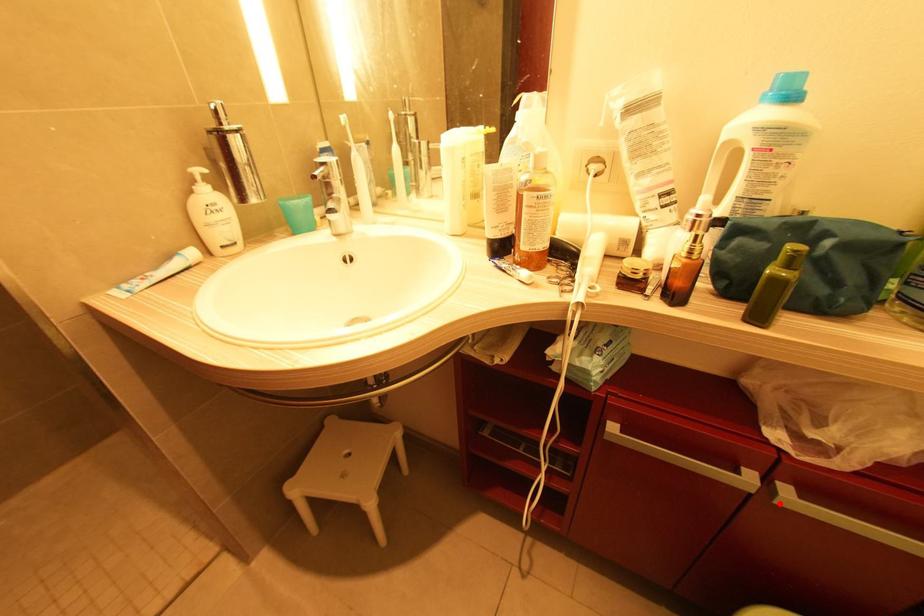
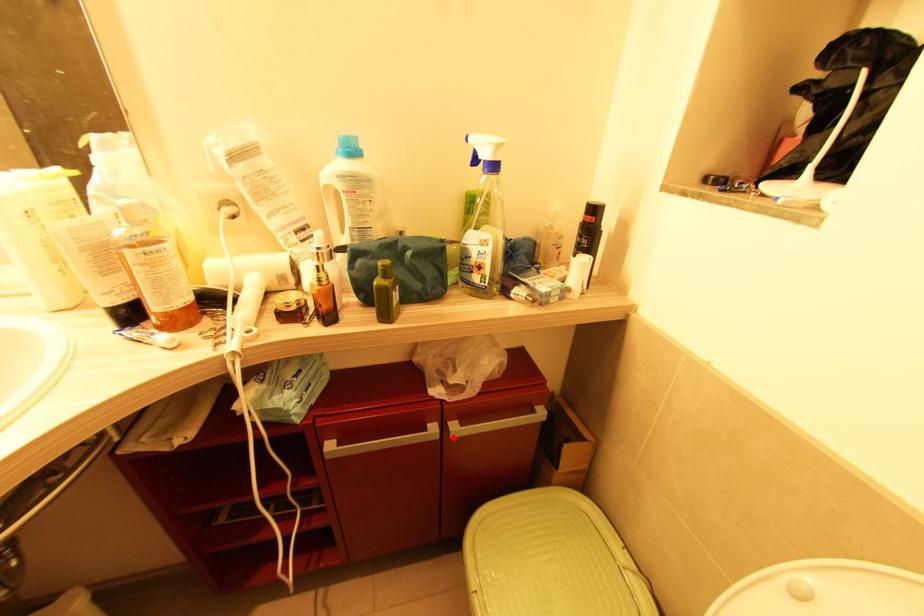
I am providing you with two images of the same scene from different viewpoints. A red point is marked on the first image and another point is marked on the second image. Is the red point in image1 aligned with the point shown in image2?

Yes